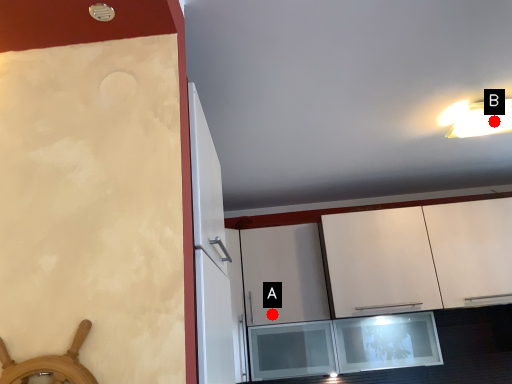
Question: Two points are circled on the image, labeled by A and B beside each circle. Which point is closer to the camera?

Choices:
 (A) A is closer
 (B) B is closer

Answer: (B)